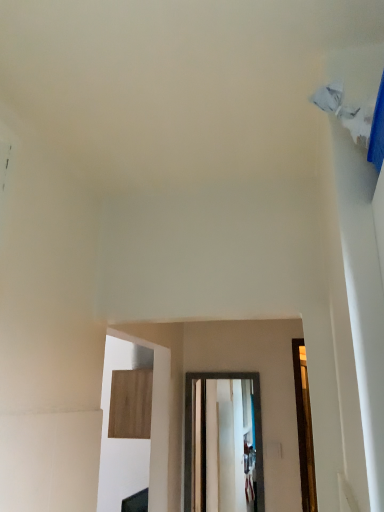
Find the location of a particular element. This screenshot has width=384, height=512. transparent glass door at center is located at coordinates (255, 421).

In order to face transparent glass door at center, should I rotate leftwards or rightwards?

Turn right approximately 4.009 degrees to face it.

What do you see at coordinates (255, 421) in the screenshot? Image resolution: width=384 pixels, height=512 pixels. I see `transparent glass door at center` at bounding box center [255, 421].

Identify the location of wooden panel at center. (131, 404).

What do you see at coordinates (131, 404) in the screenshot? I see `wooden panel at center` at bounding box center [131, 404].

Where is `transparent glass door at center`? This screenshot has height=512, width=384. transparent glass door at center is located at coordinates (255, 421).

Visually, is transparent glass door at center positioned to the left or to the right of wooden panel at center?

Based on their positions, transparent glass door at center is located to the right of wooden panel at center.

Is transparent glass door at center closer to the viewer compared to wooden panel at center?

Yes, the depth of transparent glass door at center is less than that of wooden panel at center.

Is point (257, 436) more distant than point (122, 426)?

No, (257, 436) is closer to viewer.

From the image's perspective, is transparent glass door at center located above wooden panel at center?

No, from the image's perspective, transparent glass door at center is not on top of wooden panel at center.

From a real-world perspective, relative to wooden panel at center, is transparent glass door at center vertically above or below?

In terms of real-world spatial position, transparent glass door at center is below wooden panel at center.

Considering the sizes of transparent glass door at center and wooden panel at center in the image, is transparent glass door at center wider or thinner than wooden panel at center?

Considering their sizes, transparent glass door at center looks slimmer than wooden panel at center.

Based on the photo, which of these two, transparent glass door at center or wooden panel at center, stands shorter?

wooden panel at center is shorter.

Considering the sizes of objects transparent glass door at center and wooden panel at center in the image provided, who is bigger, transparent glass door at center or wooden panel at center?

wooden panel at center is bigger.

Is wooden panel at center located within transparent glass door at center?

Definitely not — wooden panel at center is not inside transparent glass door at center.

In the scene shown: Is transparent glass door at center next to wooden panel at center and touching it?

No, transparent glass door at center is not beside wooden panel at center.

Is wooden panel at center at the back of transparent glass door at center?

Result: No, wooden panel at center is not at the back of transparent glass door at center.

How distant is transparent glass door at center from wooden panel at center?

transparent glass door at center and wooden panel at center are 15.36 inches apart.

Identify the location of plywood on the left of the transparent glass door at center. (131, 404).

Is wooden panel at center to the left or to the right of transparent glass door at center in the image?

From the image, it's evident that wooden panel at center is to the left of transparent glass door at center.

Is the depth of wooden panel at center less than that of transparent glass door at center?

No, wooden panel at center is further to the viewer.

Which is behind, point (115, 436) or point (261, 433)?

Positioned behind is point (115, 436).

From the image's perspective, between wooden panel at center and transparent glass door at center, who is located below?

From the image's view, transparent glass door at center is below.

From a real-world perspective, is wooden panel at center physically below transparent glass door at center?

No.

Does wooden panel at center have a lesser width compared to transparent glass door at center?

Incorrect, the width of wooden panel at center is not less than that of transparent glass door at center.

From their relative heights in the image, would you say wooden panel at center is taller or shorter than transparent glass door at center?

Considering their sizes, wooden panel at center has less height than transparent glass door at center.

Based on their sizes in the image, would you say wooden panel at center is bigger or smaller than transparent glass door at center?

Considering their sizes, wooden panel at center takes up more space than transparent glass door at center.

Would you say wooden panel at center is outside transparent glass door at center?

Yes, wooden panel at center is not within transparent glass door at center.

Is there a large distance between wooden panel at center and transparent glass door at center?

wooden panel at center is actually quite close to transparent glass door at center.

Does wooden panel at center turn towards transparent glass door at center?

No, wooden panel at center is not oriented towards transparent glass door at center.

Identify the location of plywood behind the transparent glass door at center. (131, 404).

Image resolution: width=384 pixels, height=512 pixels. In order to click on glass door below the wooden panel at center (from a real-world perspective) in this screenshot , I will do `click(255, 421)`.

Locate an element on the screen. The image size is (384, 512). glass door that appears in front of the wooden panel at center is located at coordinates (255, 421).